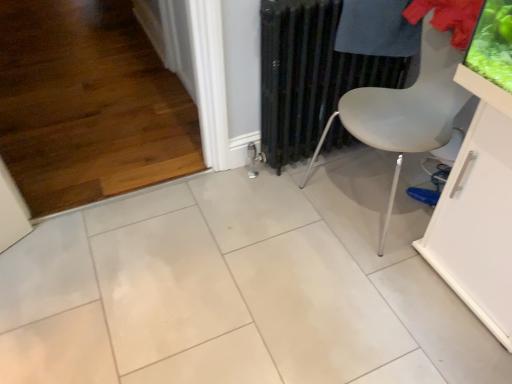
This screenshot has height=384, width=512. What are the coordinates of `free space that is in between white matte chair at center-right and white glossy table at lower right` in the screenshot? It's located at (424, 278).